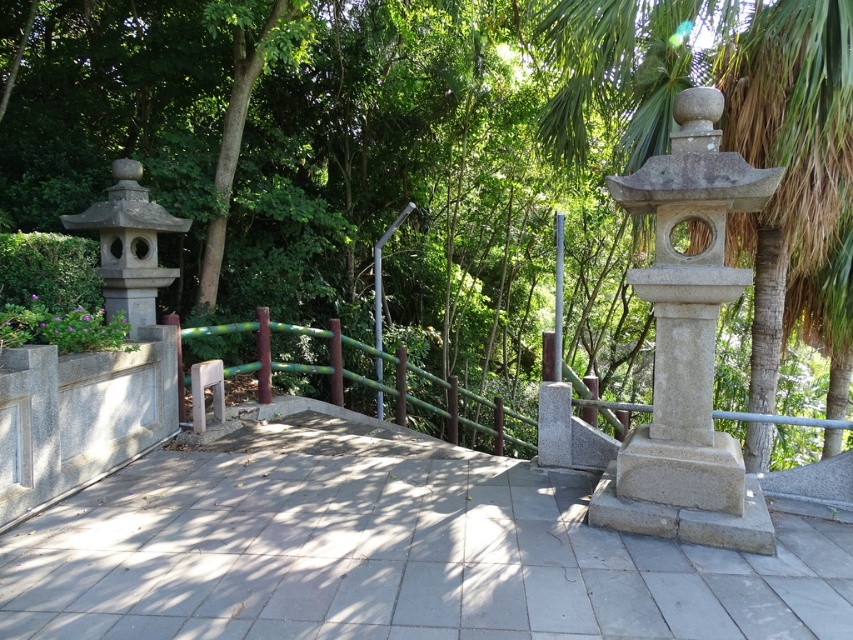
Can you confirm if gray concrete path at center is smaller than green bamboo rail at center?

Indeed, gray concrete path at center has a smaller size compared to green bamboo rail at center.

From the picture: Who is lower down, gray concrete path at center or green bamboo rail at center?

Positioned lower is gray concrete path at center.

You are a GUI agent. You are given a task and a screenshot of the screen. Output one action in this format:
    pyautogui.click(x=<x>, y=<y>)
    Task: Click on the gray concrete path at center
    
    Given the screenshot: What is the action you would take?
    pyautogui.click(x=389, y=548)

You are a GUI agent. You are given a task and a screenshot of the screen. Output one action in this format:
    pyautogui.click(x=<x>, y=<y>)
    Task: Click on the gray concrete path at center
    Image resolution: width=853 pixels, height=640 pixels.
    Given the screenshot: What is the action you would take?
    pyautogui.click(x=389, y=548)

Does gray concrete path at center appear on the left side of gray stone palm tree at upper right?

Indeed, gray concrete path at center is positioned on the left side of gray stone palm tree at upper right.

How distant is gray concrete path at center from gray stone palm tree at upper right?

gray concrete path at center and gray stone palm tree at upper right are 3.44 meters apart.

Consider the image. Who is more forward, (444, 458) or (827, 172)?

Point (827, 172) is in front.

Image resolution: width=853 pixels, height=640 pixels. What are the coordinates of `gray concrete path at center` in the screenshot? It's located at (389, 548).

Identify the location of gray concrete path at center. (389, 548).

Between gray concrete path at center and gray stone lantern at upper right, which one is positioned lower?

gray concrete path at center is below.

Who is more forward, (498, 588) or (700, 316)?

Positioned in front is point (498, 588).

You are a GUI agent. You are given a task and a screenshot of the screen. Output one action in this format:
    pyautogui.click(x=<x>, y=<y>)
    Task: Click on the gray concrete path at center
    
    Given the screenshot: What is the action you would take?
    pyautogui.click(x=389, y=548)